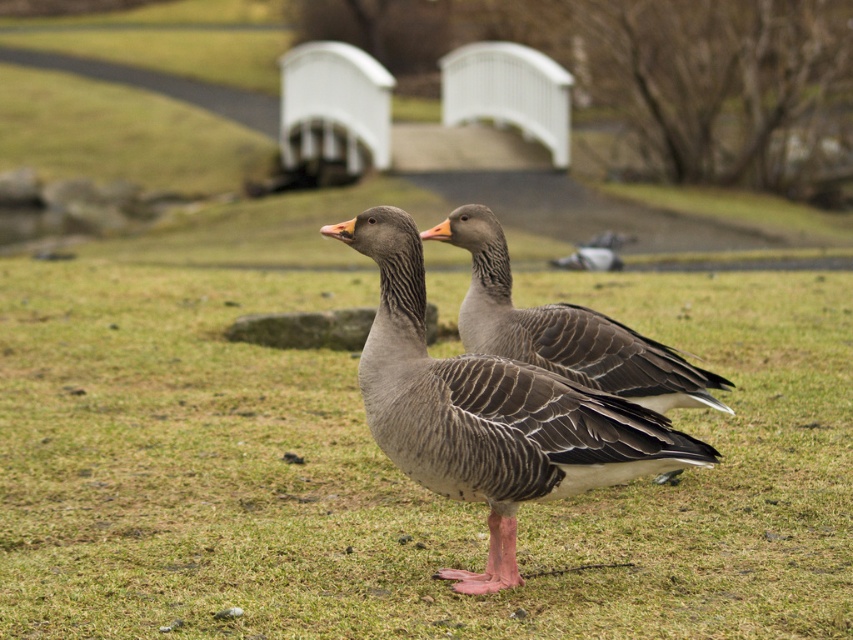
Who is taller, gray matte goose at center or gray matte pigeon at center?

gray matte goose at center is taller.

Between point (636, 369) and point (618, 266), which one is positioned behind?

The point (618, 266) is behind.

You are a GUI agent. You are given a task and a screenshot of the screen. Output one action in this format:
    pyautogui.click(x=<x>, y=<y>)
    Task: Click on the gray matte goose at center
    The height and width of the screenshot is (640, 853).
    Given the screenshot: What is the action you would take?
    pyautogui.click(x=564, y=328)

Does gray matte duck at center have a greater height compared to gray matte pigeon at center?

Yes.

Does gray matte duck at center appear over gray matte pigeon at center?

Incorrect, gray matte duck at center is not positioned above gray matte pigeon at center.

Does point (387, 444) lie in front of point (560, 262)?

Yes, it is in front of point (560, 262).

I want to click on gray matte duck at center, so (x=489, y=412).

Consider the image. Who is lower down, gray matte duck at center or gray matte goose at center?

gray matte duck at center is below.

Is gray matte duck at center to the left of gray matte goose at center from the viewer's perspective?

Yes, gray matte duck at center is to the left of gray matte goose at center.

Is point (370, 385) closer to camera compared to point (589, 337)?

That is True.

This screenshot has height=640, width=853. Find the location of `gray matte duck at center`. gray matte duck at center is located at coordinates (489, 412).